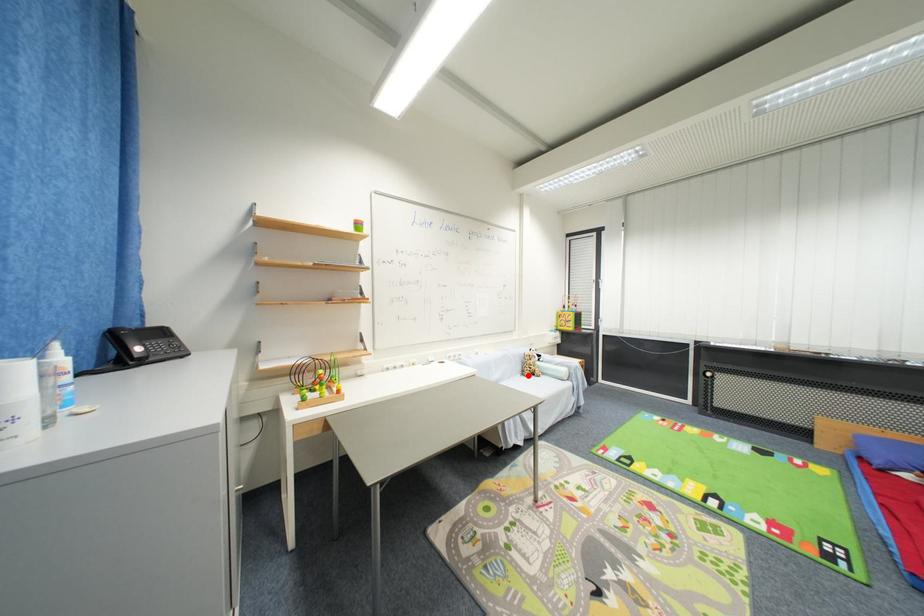
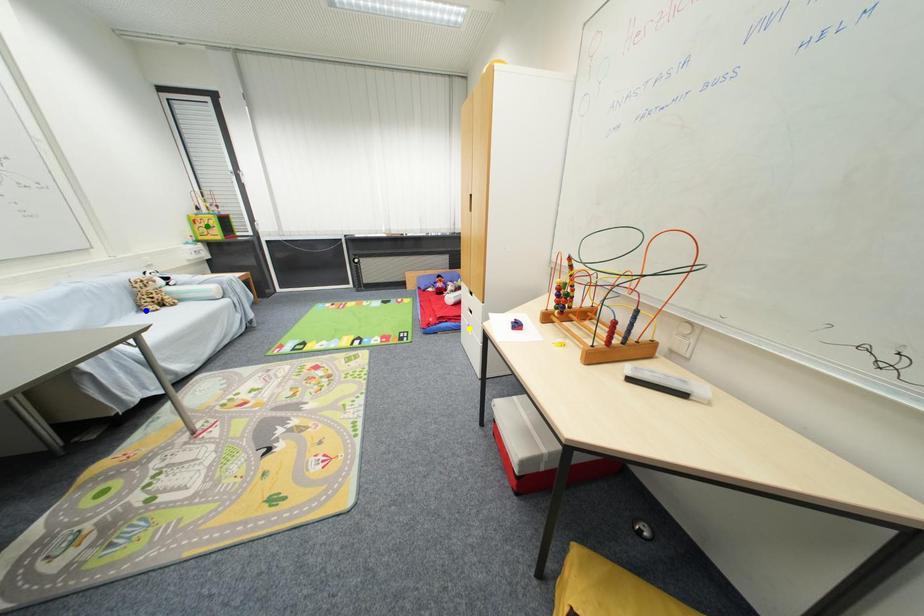
Question: I am providing you with two images of the same scene from different viewpoints. A red point is marked on the first image. You are given multiple points on the second image. Which point in image 2 is actually the same real-world point as the red point in image 1?

Choices:
 (A) green point
 (B) blue point
 (C) yellow point

Answer: (B)